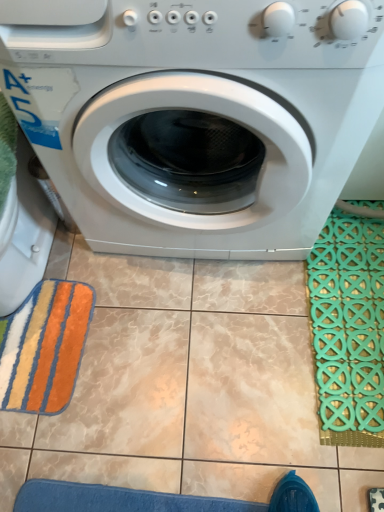
At what (x,y) coordinates should I click in order to perform the action: click on blank space situated above multicolored plush bath towel at lower left (from a real-world perspective). Please return your answer as a coordinate pair (x, y). Looking at the image, I should click on (42, 339).